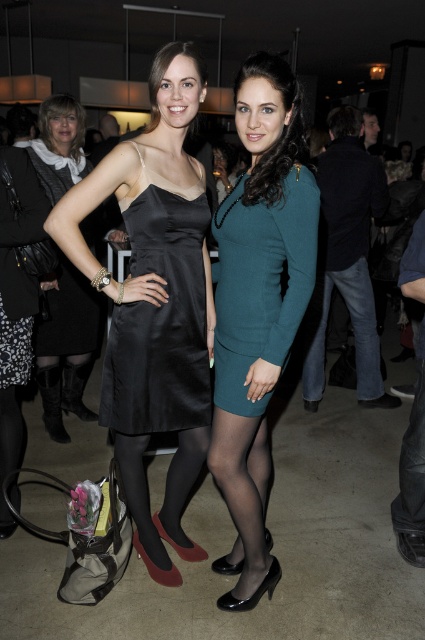
Question: Estimate the real-world distances between objects in this image. Which object is closer to the satin black dress at left?

Choices:
 (A) teal woolen dress at center
 (B) jeans at center
 (C) matte black dress at left

Answer: (A)

Question: Does satin dress at left appear over matte black dress at left?

Choices:
 (A) no
 (B) yes

Answer: (A)

Question: Considering the real-world distances, which object is farthest from the teal wool dress at center?

Choices:
 (A) matte black dress at left
 (B) jeans at center
 (C) teal woolen dress at center
 (D) satin dress at left

Answer: (B)

Question: Is matte black dress at left positioned at the back of jeans at center?

Choices:
 (A) no
 (B) yes

Answer: (A)

Question: Does teal wool dress at center have a larger size compared to teal woolen dress at center?

Choices:
 (A) yes
 (B) no

Answer: (A)

Question: Which of the following is the farthest from the observer?

Choices:
 (A) coord(305,250)
 (B) coord(357,388)
 (C) coord(48,426)

Answer: (B)